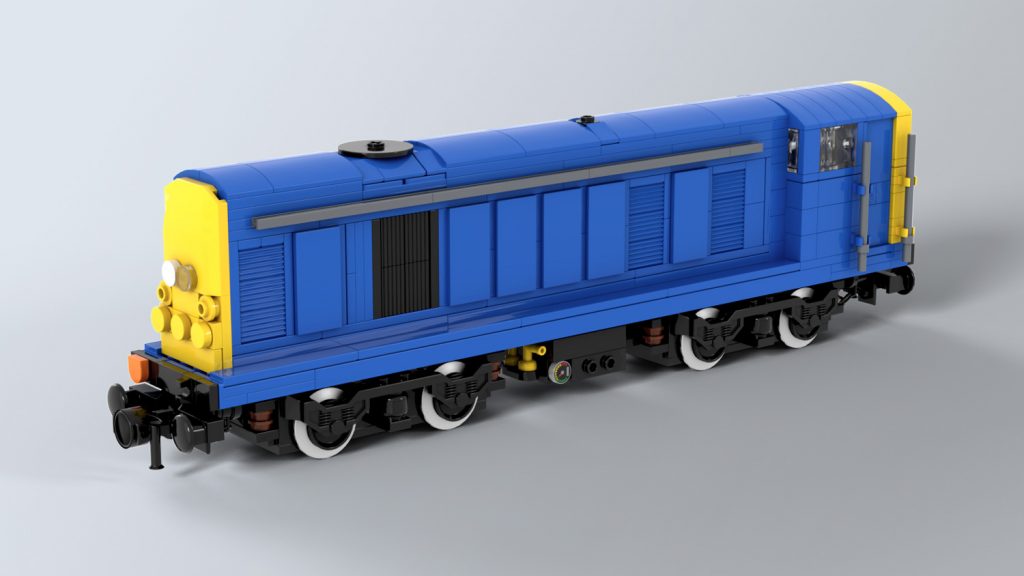
I want to click on light gray wall, so click(805, 37).